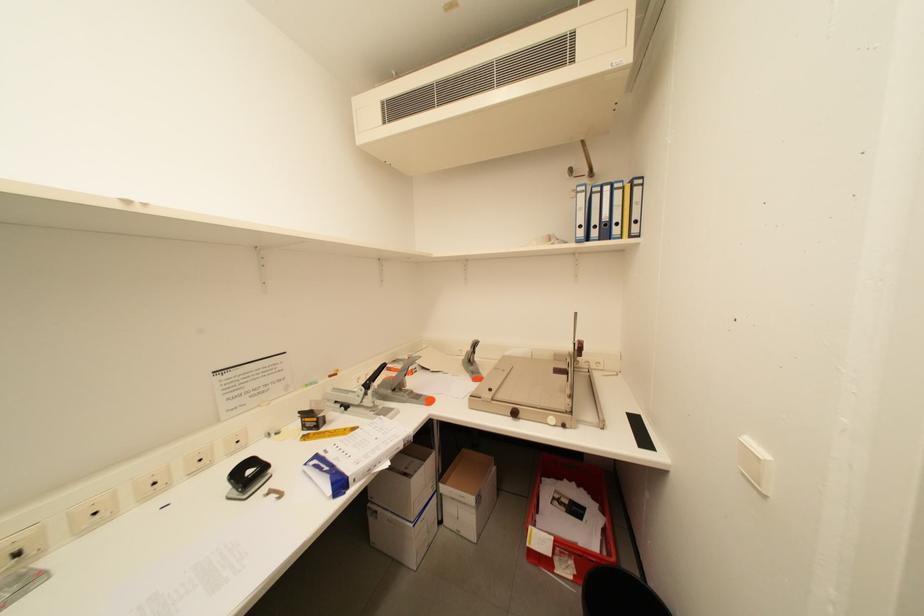
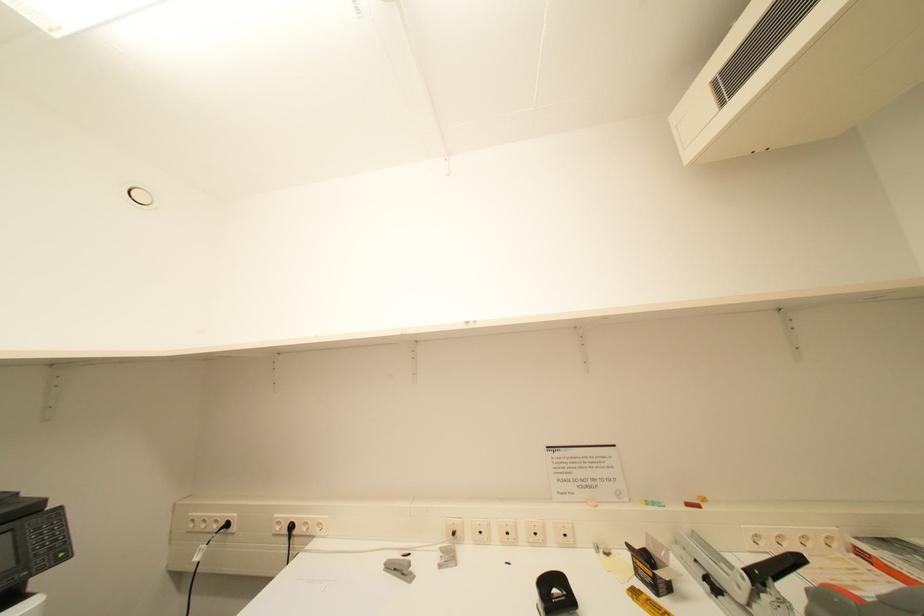
Question: How did the camera likely rotate?

Choices:
 (A) Left
 (B) Right
 (C) Up
 (D) Down

Answer: (A)